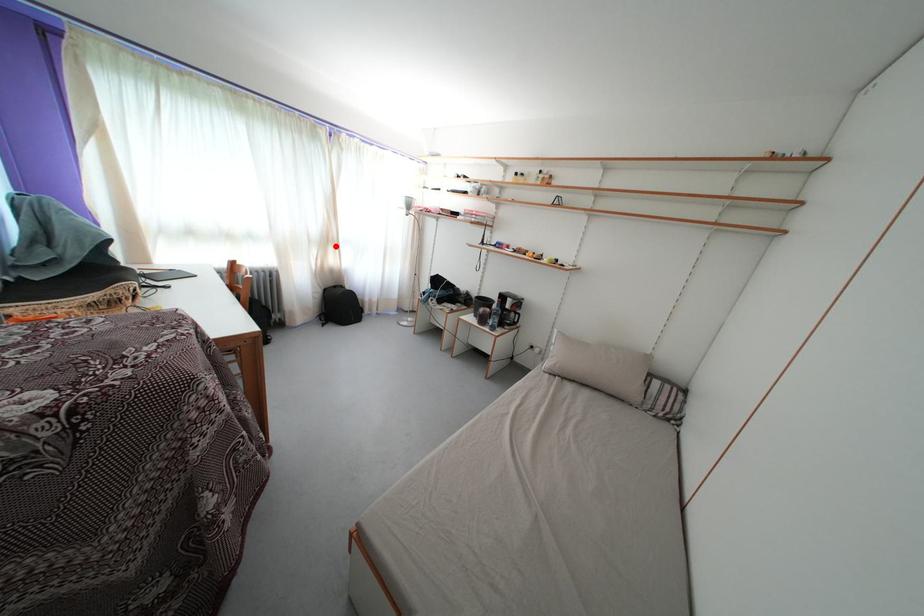
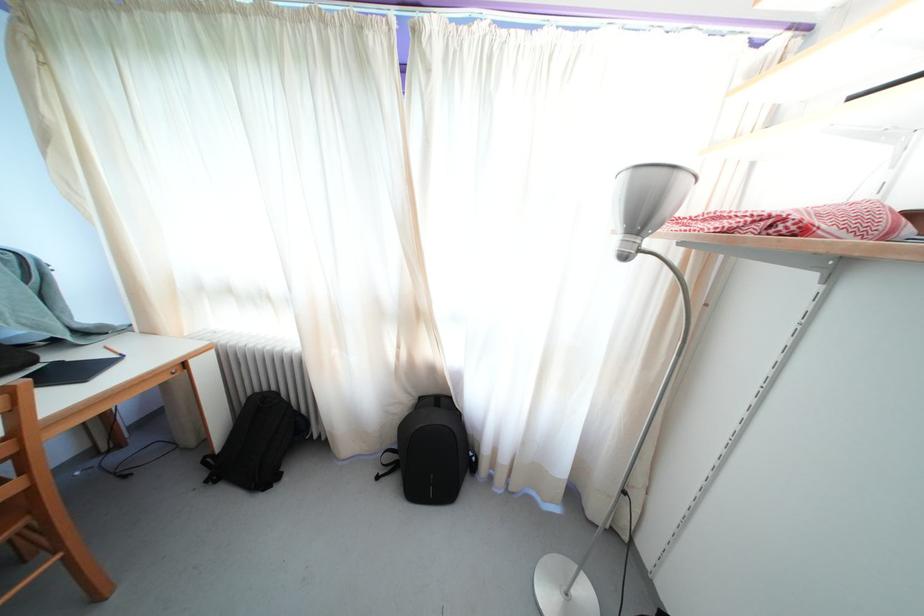
Question: A red point is marked in image1. In image2, is the corresponding 3D point closer to the camera or farther? Reply with the corresponding letter.

Choices:
 (A) The corresponding 3D point is closer.
 (B) The corresponding 3D point is farther.

Answer: (B)